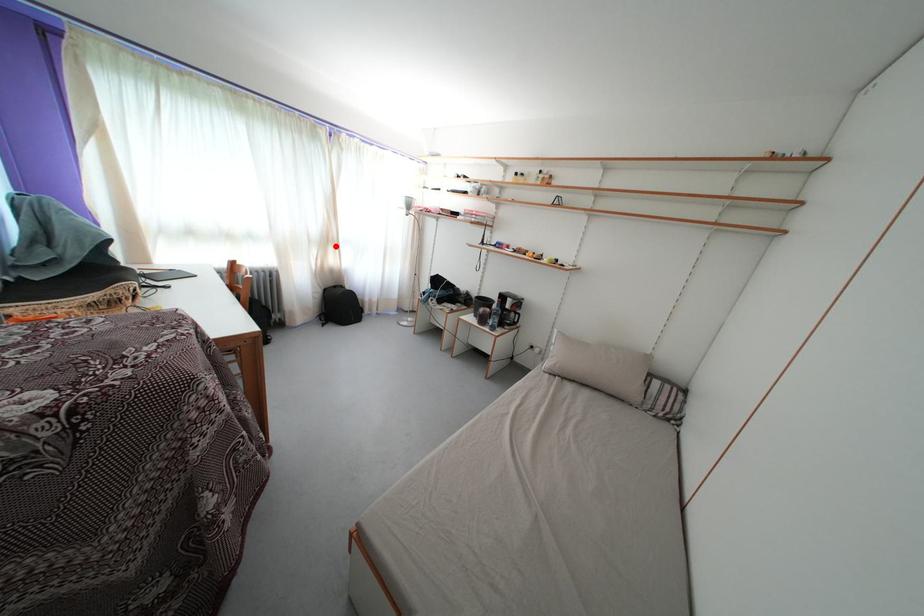
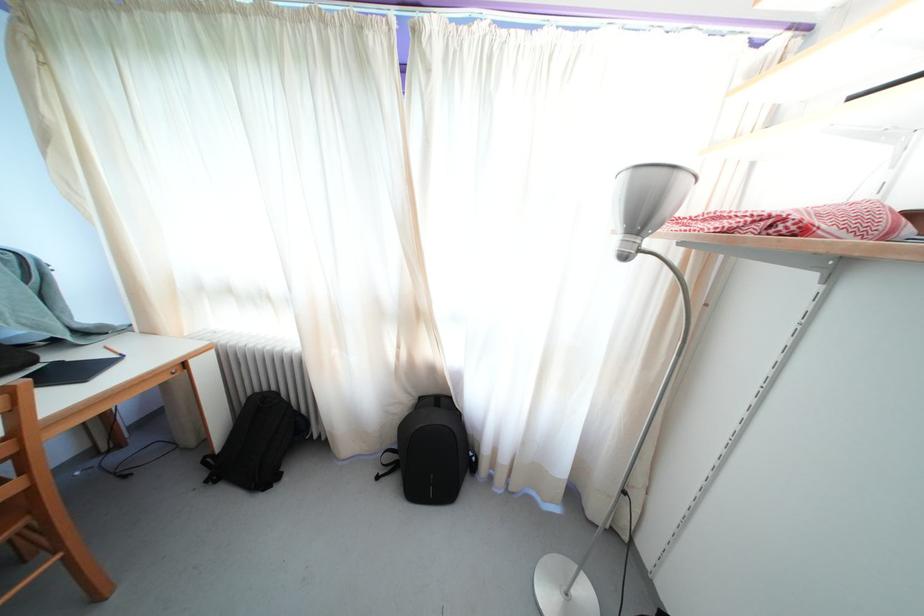
Question: A red point is marked in image1. In image2, is the corresponding 3D point closer to the camera or farther? Reply with the corresponding letter.

Choices:
 (A) The corresponding 3D point is closer.
 (B) The corresponding 3D point is farther.

Answer: (B)